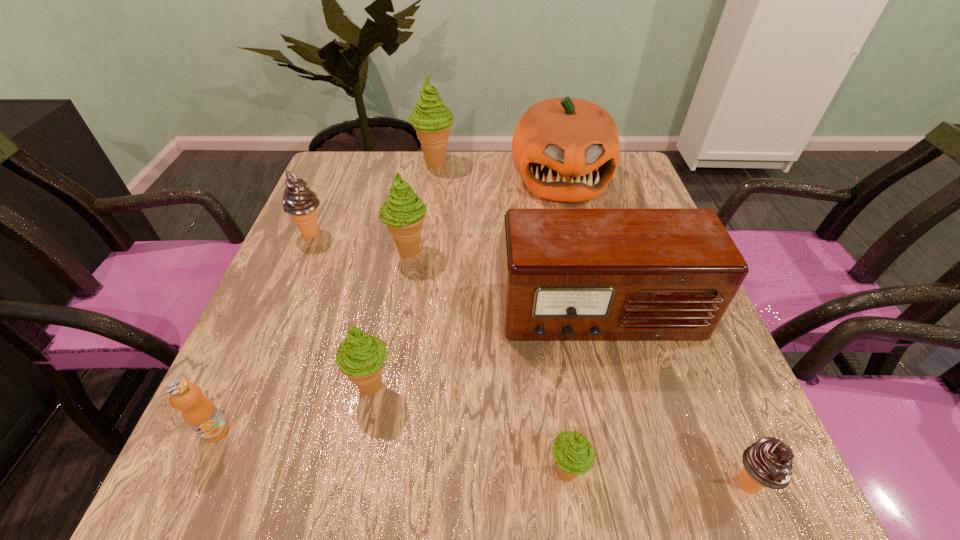
You are a GUI agent. You are given a task and a screenshot of the screen. Output one action in this format:
    pyautogui.click(x=<x>, y=<y>)
    Task: Click on the seventh farthest object
    The image size is (960, 540).
    Given the screenshot: What is the action you would take?
    pyautogui.click(x=199, y=412)

At what (x,y) coordinates should I click in order to perform the action: click on the nearest green icecream. Please return your answer as a coordinate pair (x, y). Looking at the image, I should click on (573, 454).

Image resolution: width=960 pixels, height=540 pixels. I want to click on the fifth icecream from left to right, so click(x=573, y=454).

You are a GUI agent. You are given a task and a screenshot of the screen. Output one action in this format:
    pyautogui.click(x=<x>, y=<y>)
    Task: Click on the rightmost icecream
    The image size is (960, 540).
    Given the screenshot: What is the action you would take?
    pyautogui.click(x=767, y=463)

Identify the location of the right chocolate icecream. (767, 463).

Find the location of a particular element. This screenshot has width=960, height=540. free space located on the right of the biggest green icecream is located at coordinates (542, 163).

Locate an element on the screen. The height and width of the screenshot is (540, 960). blank space located on the face of the pumpkin is located at coordinates (569, 222).

Where is `free space located on the right of the third smallest green icecream`? free space located on the right of the third smallest green icecream is located at coordinates (588, 251).

Locate an element on the screen. The width and height of the screenshot is (960, 540). free spot located on the front-facing side of the radio receiver is located at coordinates (639, 473).

Find the location of a particular element. free space located 0.380m on the front of the leftmost icecream is located at coordinates (245, 388).